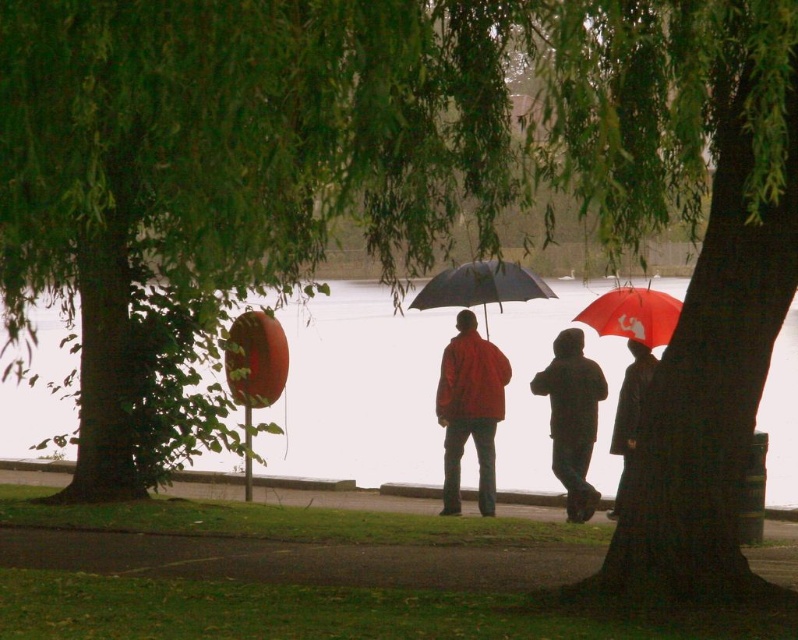
This screenshot has width=798, height=640. I want to click on green leafy tree at center, so click(x=223, y=177).

The height and width of the screenshot is (640, 798). Describe the element at coordinates (223, 177) in the screenshot. I see `green leafy tree at center` at that location.

Identify the location of green leafy tree at center. (223, 177).

Does green leafy tree at center have a greater height compared to transparent water at center?

Correct, green leafy tree at center is much taller as transparent water at center.

What do you see at coordinates (223, 177) in the screenshot?
I see `green leafy tree at center` at bounding box center [223, 177].

Identify the location of green leafy tree at center. The image size is (798, 640). (223, 177).

Between transparent water at center and matte black umbrella at center, which one appears on the right side from the viewer's perspective?

Positioned to the right is transparent water at center.

Which is above, transparent water at center or matte black umbrella at center?

matte black umbrella at center is above.

Does point (69, 365) lie in front of point (445, 284)?

No, (69, 365) is further to viewer.

What are the coordinates of `transparent water at center` in the screenshot? It's located at (358, 390).